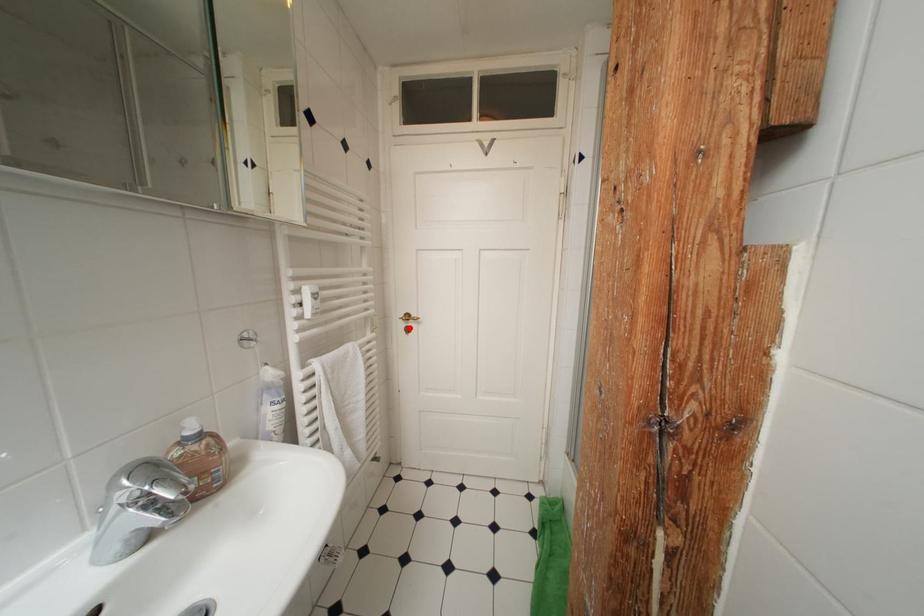
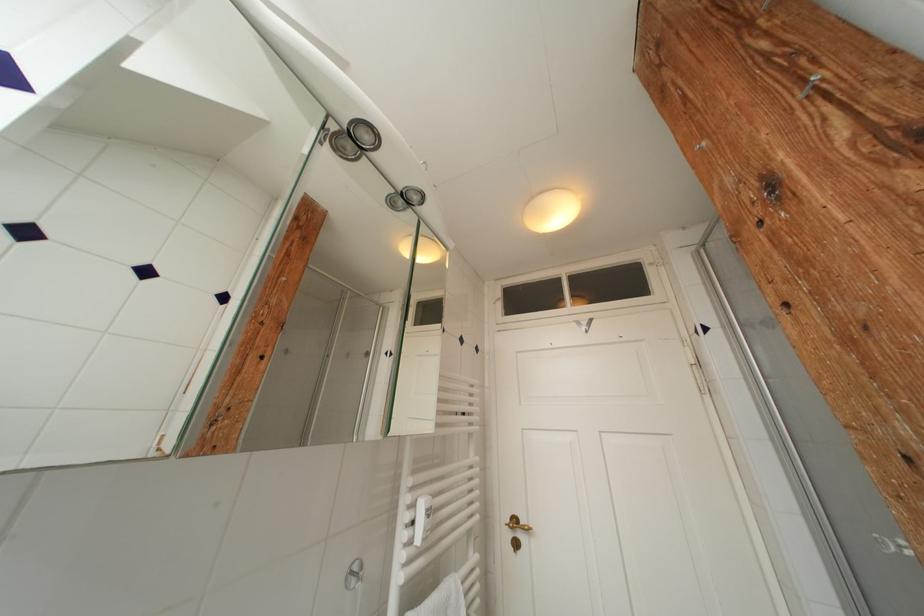
Find the pixel in the second image that matches the highlighted location in the first image.

(516, 539)